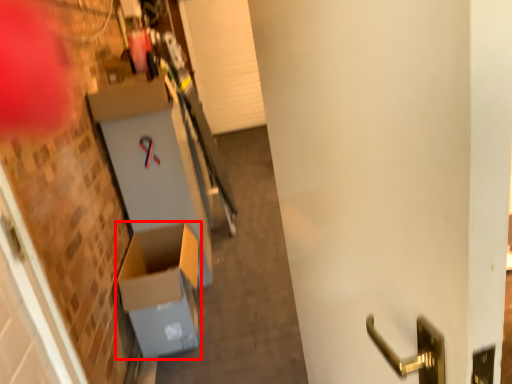
Question: From the image's perspective, where is cardboard box (annotated by the red box) located relative to door?

Choices:
 (A) above
 (B) below

Answer: (B)